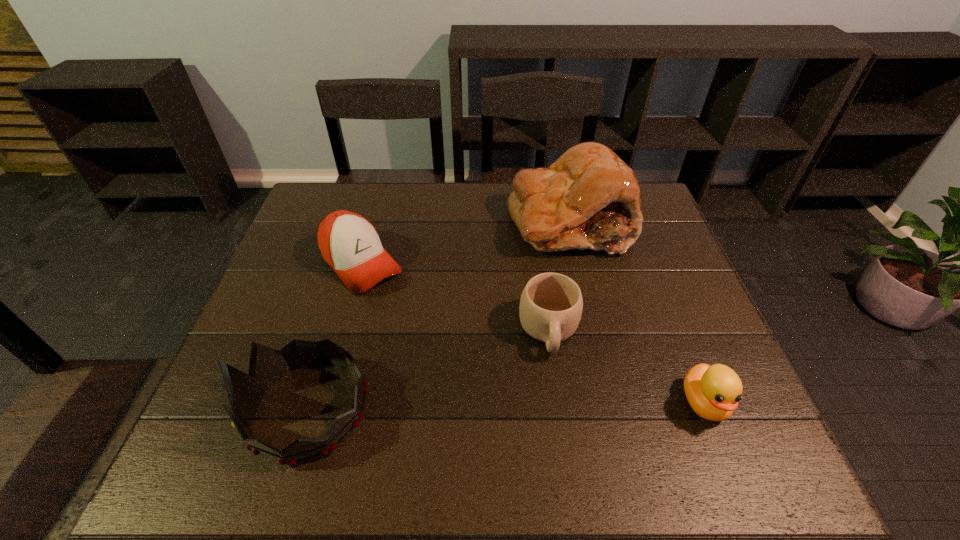
Identify the location of free space on the desktop that is between the fourth shortest object and the duckling and is positioned on the front-facing side of the baseball cap. (502, 406).

At what (x,y) coordinates should I click in order to perform the action: click on vacant spot on the desktop that is between the tiara and the duckling and is positioned on the filling side of the tallest object. Please return your answer as a coordinate pair (x, y). The image size is (960, 540). Looking at the image, I should click on (456, 407).

This screenshot has width=960, height=540. I want to click on free space on the desktop that is between the tiara and the duckling and is positioned on the side of the mug with the handle, so click(x=556, y=406).